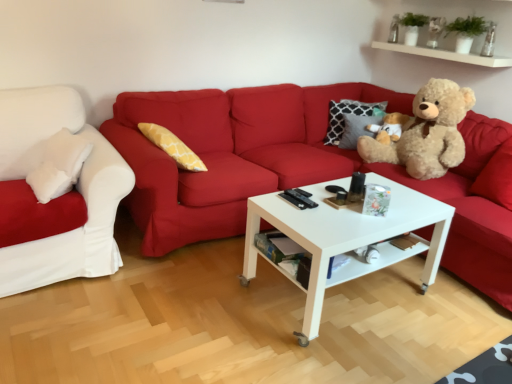
Question: Can you confirm if matte red couch at center, the 2th studio couch viewed from the left, is thinner than white glossy coffee table at center?

Choices:
 (A) yes
 (B) no

Answer: (B)

Question: Considering the relative sizes of matte red couch at center, which is counted as the first studio couch, starting from the right, and white glossy coffee table at center in the image provided, is matte red couch at center, which is counted as the first studio couch, starting from the right, shorter than white glossy coffee table at center?

Choices:
 (A) no
 (B) yes

Answer: (A)

Question: Is there a large distance between matte red couch at center, which is counted as the first studio couch, starting from the right, and white glossy coffee table at center?

Choices:
 (A) no
 (B) yes

Answer: (A)

Question: Can we say matte red couch at center, which is counted as the first studio couch, starting from the right, lies outside white glossy coffee table at center?

Choices:
 (A) no
 (B) yes

Answer: (B)

Question: Is matte red couch at center, which is counted as the first studio couch, starting from the right, to the right of white glossy coffee table at center from the viewer's perspective?

Choices:
 (A) yes
 (B) no

Answer: (A)

Question: Is matte red couch at center, the 2th studio couch viewed from the left, positioned before white glossy coffee table at center?

Choices:
 (A) no
 (B) yes

Answer: (B)

Question: Considering the relative sizes of light brown plush teddy bear at right and matte red couch at center, which is counted as the first studio couch, starting from the right, in the image provided, is light brown plush teddy bear at right smaller than matte red couch at center, which is counted as the first studio couch, starting from the right,?

Choices:
 (A) yes
 (B) no

Answer: (A)

Question: Is light brown plush teddy bear at right to the left of matte red couch at center, which is counted as the first studio couch, starting from the right, from the viewer's perspective?

Choices:
 (A) no
 (B) yes

Answer: (A)

Question: Considering the relative sizes of light brown plush teddy bear at right and matte red couch at center, the 2th studio couch viewed from the left, in the image provided, is light brown plush teddy bear at right wider than matte red couch at center, the 2th studio couch viewed from the left,?

Choices:
 (A) yes
 (B) no

Answer: (B)

Question: Is light brown plush teddy bear at right positioned beyond the bounds of matte red couch at center, the 2th studio couch viewed from the left?

Choices:
 (A) no
 (B) yes

Answer: (A)

Question: From a real-world perspective, does light brown plush teddy bear at right sit lower than matte red couch at center, which is counted as the first studio couch, starting from the right?

Choices:
 (A) no
 (B) yes

Answer: (A)

Question: Does light brown plush teddy bear at right turn towards matte red couch at center, the 2th studio couch viewed from the left?

Choices:
 (A) no
 (B) yes

Answer: (B)

Question: Is white glossy coffee table at center beside light brown plush teddy bear at right?

Choices:
 (A) no
 (B) yes

Answer: (A)